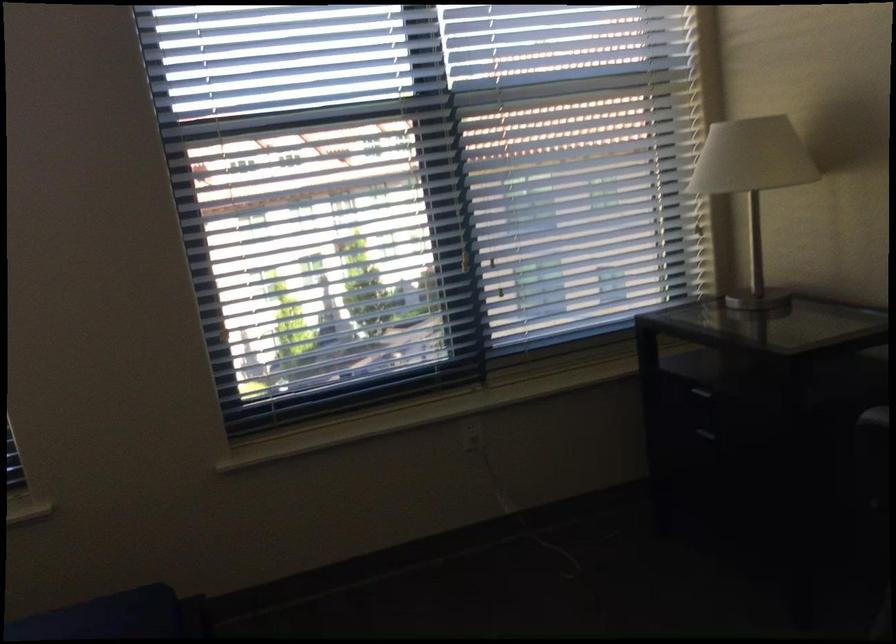
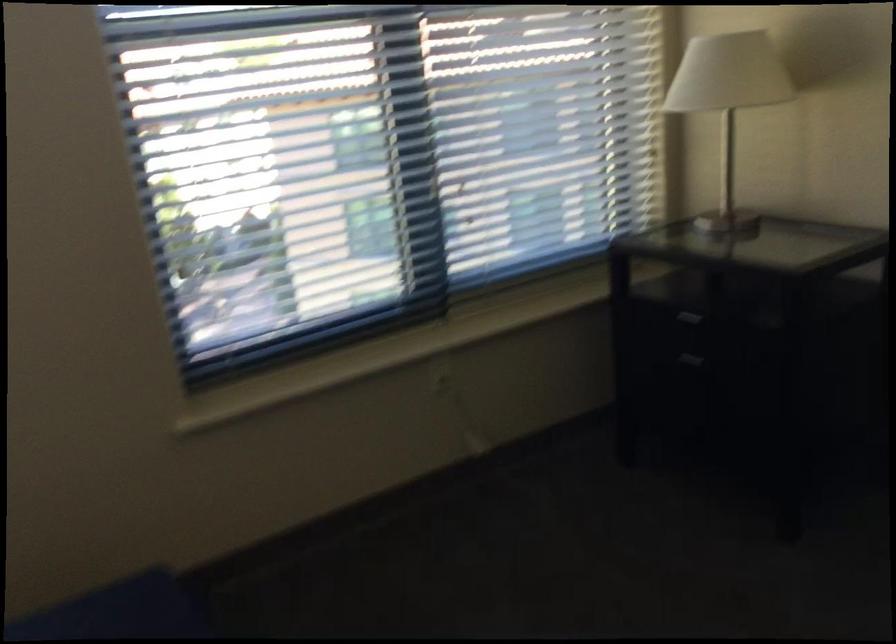
Find the pixel in the second image that matches (698,404) in the first image.

(682, 330)